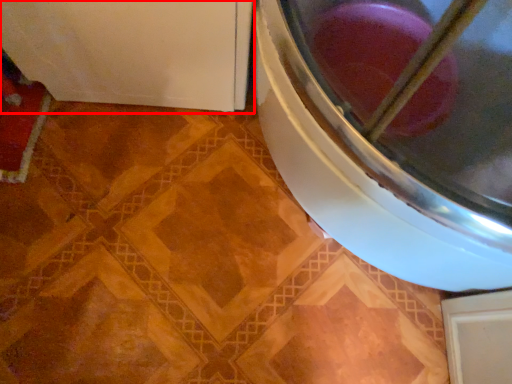
Question: From the image's perspective, considering the relative positions of appliance (annotated by the red box) and washing machine in the image provided, where is appliance (annotated by the red box) located with respect to the staircase?

Choices:
 (A) below
 (B) above

Answer: (B)